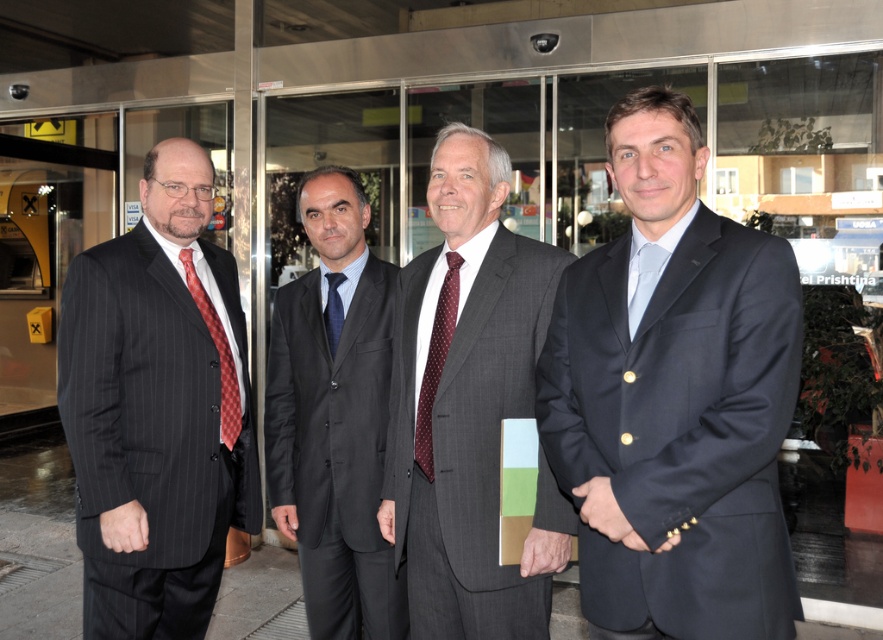
You are standing at the entrance of the building and want to touch the point at coordinates point (436, 547). Can you reach it without moving your feet?

The distance of point (436, 547) from camera is 7.66 feet, so you cannot reach it without moving your feet since it is too far away.

You are a photographer trying to capture a group photo of the men in the scene. You want to ensure that the gray pinstripe suit at center and the dark gray suit at center are both clearly visible in the frame. Given their sizes, which of the two suits should you position closer to the camera to make them appear the same size in the photo?

Since the gray pinstripe suit at center is smaller than the dark gray suit at center, you should position the gray pinstripe suit at center closer to the camera. This way, the smaller suit will appear larger in the photo, balancing the sizes with the larger dark gray suit at center.